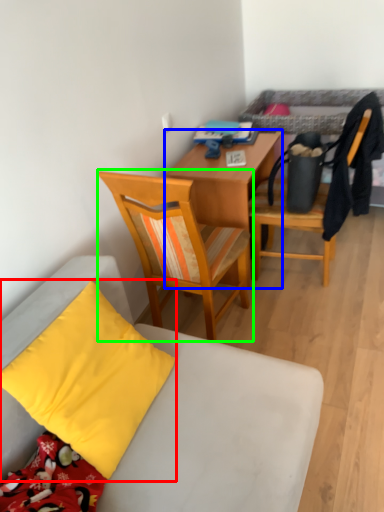
Question: Estimate the real-world distances between objects in this image. Which object is closer to pillow (highlighted by a red box), desk (highlighted by a blue box) or chair (highlighted by a green box)?

Choices:
 (A) desk
 (B) chair

Answer: (B)